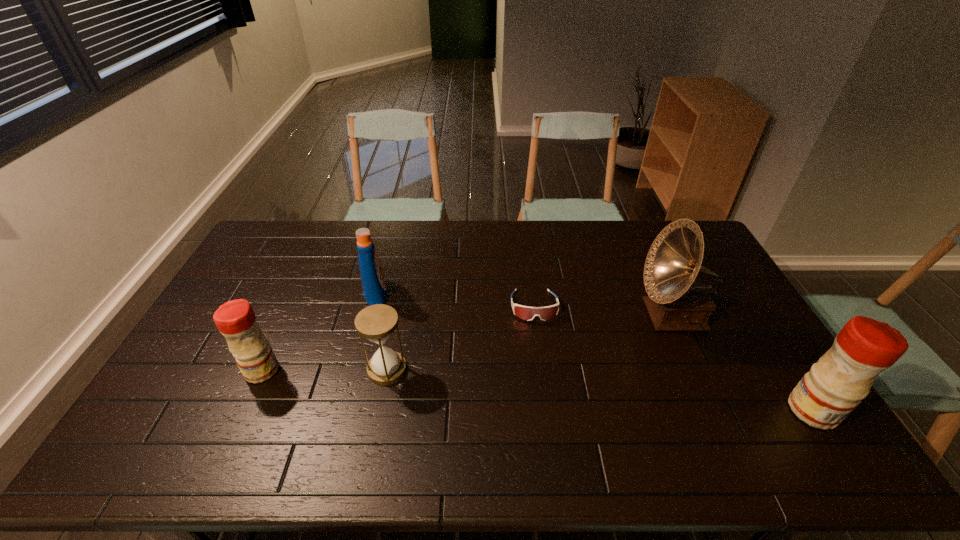
This screenshot has height=540, width=960. Find the location of `vacant space located 0.050m on the left of the nearer condiment`. vacant space located 0.050m on the left of the nearer condiment is located at coordinates (770, 410).

The height and width of the screenshot is (540, 960). I want to click on vacant space located on the label of the detergent, so click(x=433, y=293).

Find the location of a particular element. vacant space located on the horn of the second object from right to left is located at coordinates (532, 315).

The image size is (960, 540). Identify the location of vacant point located 0.140m on the horn of the second object from right to left. (594, 315).

Find the location of a particular element. free spot located 0.060m on the horn of the second object from right to left is located at coordinates (620, 315).

At what (x,y) coordinates should I click in order to perform the action: click on free region located on the front-facing side of the shortest object. Please return your answer as a coordinate pair (x, y). Image resolution: width=960 pixels, height=540 pixels. Looking at the image, I should click on (540, 349).

Where is `vacant space located on the right of the second shortest object`? The image size is (960, 540). vacant space located on the right of the second shortest object is located at coordinates pyautogui.click(x=438, y=369).

You are a GUI agent. You are given a task and a screenshot of the screen. Output one action in this format:
    pyautogui.click(x=<x>, y=<y>)
    Task: Click on the object positioned at the near edge
    
    Given the screenshot: What is the action you would take?
    pyautogui.click(x=835, y=385)

Identify the location of condiment positioned at the right edge. (835, 385).

You are a GUI agent. You are given a task and a screenshot of the screen. Output one action in this format:
    pyautogui.click(x=<x>, y=<y>)
    Task: Click on the phonograph record that is at the right edge
    This screenshot has width=960, height=540.
    Given the screenshot: What is the action you would take?
    pyautogui.click(x=678, y=301)